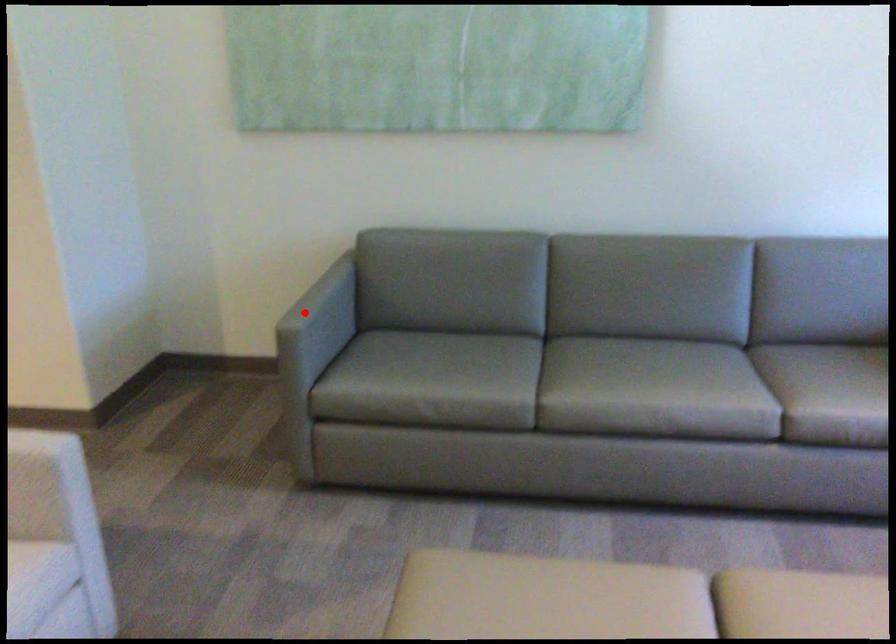
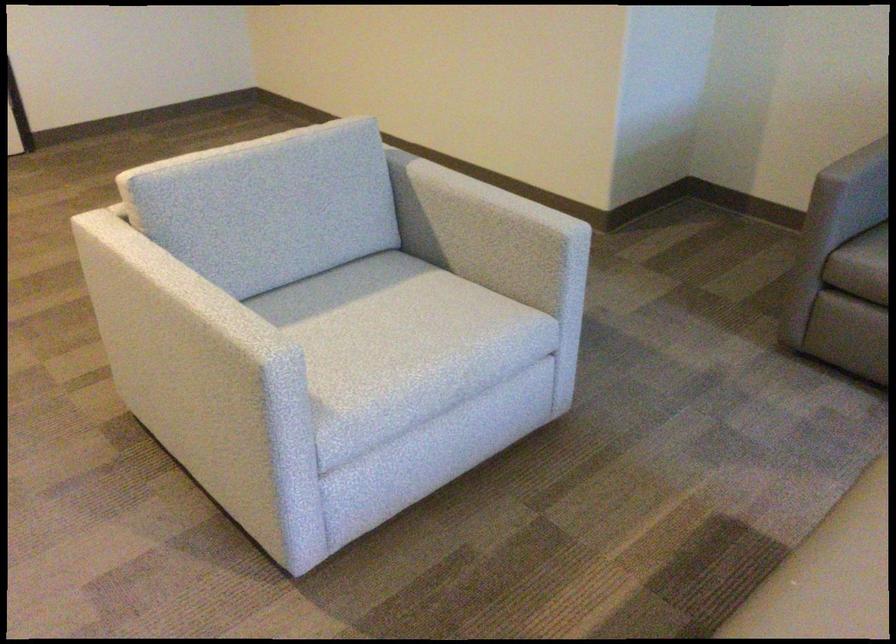
Question: A red point is marked in image1. In image2, is the corresponding 3D point closer to the camera or farther? Reply with the corresponding letter.

Choices:
 (A) The corresponding 3D point is closer.
 (B) The corresponding 3D point is farther.

Answer: (A)